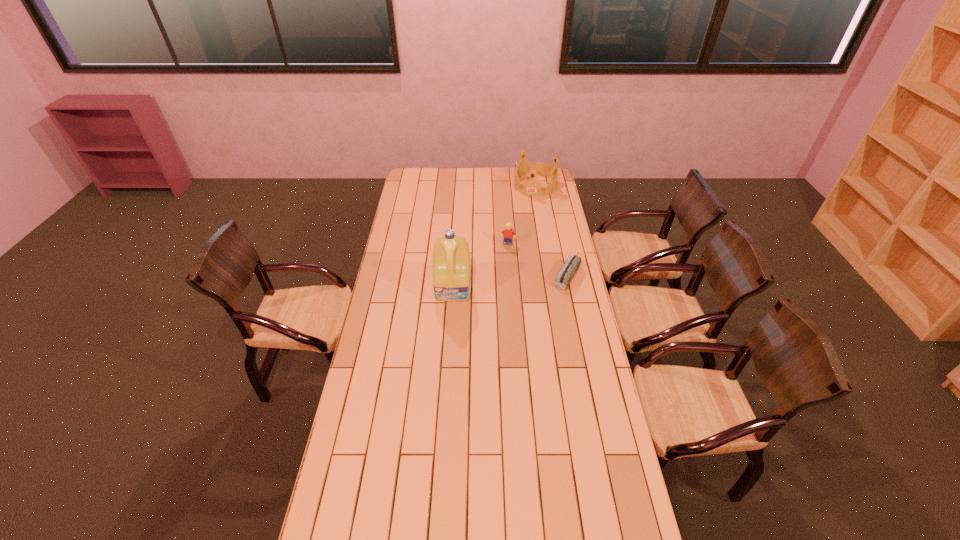
The height and width of the screenshot is (540, 960). I want to click on vacant area that lies between the pencil box and the second tallest object, so click(551, 230).

At what (x,y) coordinates should I click in order to perform the action: click on vacant region between the Lego and the shortest object. Please return your answer as a coordinate pair (x, y). This screenshot has width=960, height=540. Looking at the image, I should click on (538, 259).

At what (x,y) coordinates should I click in order to perform the action: click on free space between the shortest object and the second farthest object. Please return your answer as a coordinate pair (x, y). Looking at the image, I should click on (538, 259).

Identify the location of empty space that is in between the leftmost object and the tiara. (494, 237).

Identify the location of vacant space that is in between the tallest object and the tiara. Image resolution: width=960 pixels, height=540 pixels. (494, 237).

Locate which object ranks second in proximity to the tallest object. Please provide its 2D coordinates. Your answer should be formatted as a tuple, i.e. [(x, y)], where the tuple contains the x and y coordinates of a point satisfying the conditions above.

[(568, 270)]

Find the location of a particular element. The width and height of the screenshot is (960, 540). object that is the second closest to the second shortest object is located at coordinates (451, 259).

This screenshot has height=540, width=960. In order to click on free space that satisfies the following two spatial constraints: 1. on the front side of the shortest object; 2. on the right side of the Lego in this screenshot , I will do `click(510, 274)`.

Where is `free space that satisfies the following two spatial constraints: 1. on the front side of the tiara; 2. on the right side of the shortest object`? This screenshot has height=540, width=960. free space that satisfies the following two spatial constraints: 1. on the front side of the tiara; 2. on the right side of the shortest object is located at coordinates (550, 274).